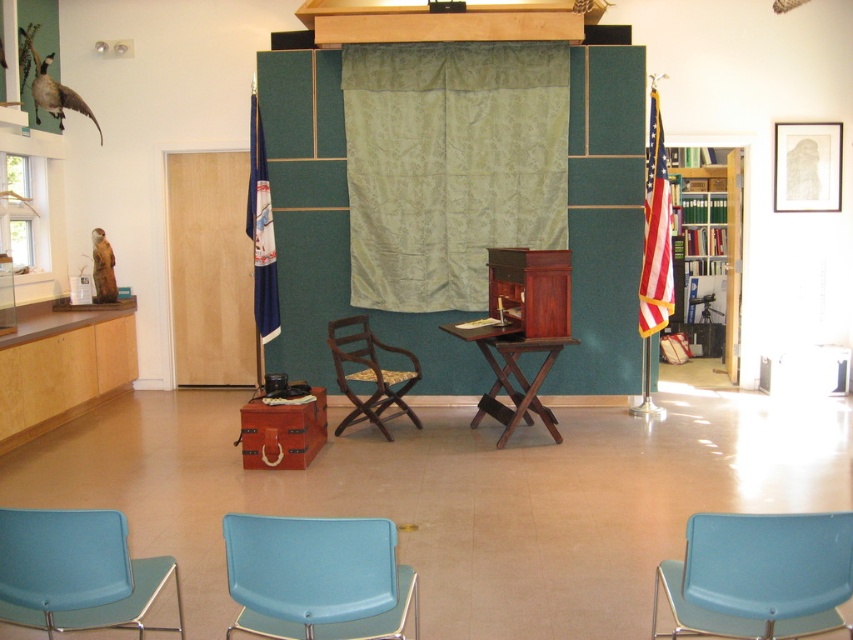
You are a presenter who needs to move from the matte blue chair at lower right to the light blue plastic chair at lower center during your talk. Can you easily walk between them without needing to move any other furniture?

The matte blue chair at lower right and light blue plastic chair at lower center are 38.03 inches apart from each other, so there is enough space for you to walk between them without needing to move any other furniture.

You are organizing a small event and need to ensure that the green velvet curtain at center is visible to all attendees seated in the matte blue chair at lower left. Based on their heights, will the curtain be visible from that chair?

The green velvet curtain at center has a greater height compared to the matte blue chair at lower left, so the curtain will be visible from the matte blue chair at lower left since it is taller than the chair.